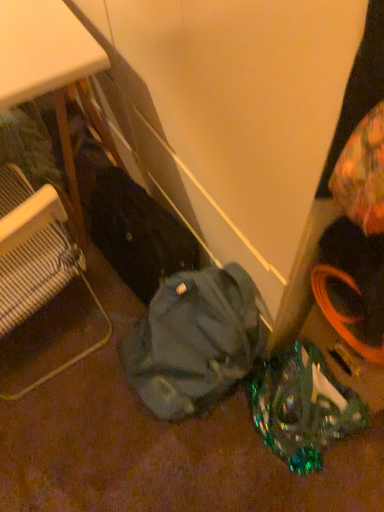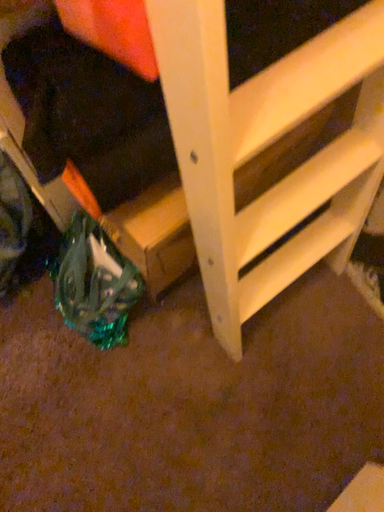
Question: Which way did the camera rotate in the video?

Choices:
 (A) rotated right
 (B) rotated left

Answer: (A)